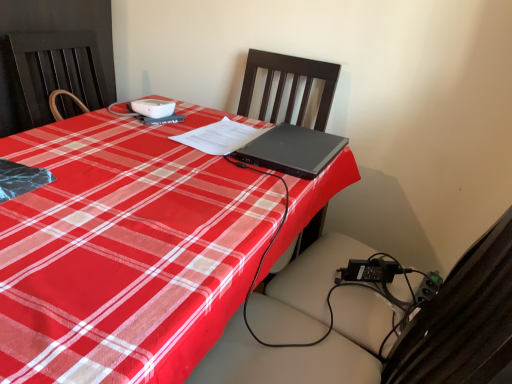
Describe the element at coordinates (292, 150) in the screenshot. I see `black matte laptop at center` at that location.

Image resolution: width=512 pixels, height=384 pixels. Identify the location of black matte laptop at center. click(292, 150).

Would you say black wood chair at center is part of black plastic swivel chair at center's contents?

No, black wood chair at center is located outside of black plastic swivel chair at center.

Is black plastic swivel chair at center in front of or behind black wood chair at center in the image?

Clearly, black plastic swivel chair at center is in front of black wood chair at center.

Which of these two, black plastic swivel chair at center or black wood chair at center, is bigger?

Bigger between the two is black plastic swivel chair at center.

From the image's perspective, is black matte laptop at center beneath black wood chair at center?

Yes, from the image's perspective, black matte laptop at center is below black wood chair at center.

Between black matte laptop at center and black wood chair at center, which one is positioned in front?

Positioned in front is black wood chair at center.

From a real-world perspective, does black matte laptop at center sit lower than black wood chair at center?

Incorrect, from a real-world perspective, black matte laptop at center is higher than black wood chair at center.

Is point (277, 107) closer or farther from the camera than point (263, 159)?

Clearly, point (277, 107) is more distant from the camera than point (263, 159).

How distant is black wood chair at center from black matte laptop at center?

A distance of 37.46 centimeters exists between black wood chair at center and black matte laptop at center.

Is black wood chair at center inside or outside of black matte laptop at center?

black wood chair at center exists outside the volume of black matte laptop at center.

Which object is positioned more to the right, black wood chair at center or black matte laptop at center?

black matte laptop at center is more to the right.

Where is `laptop that is above the black plastic swivel chair at center (from a real-world perspective)`? The width and height of the screenshot is (512, 384). laptop that is above the black plastic swivel chair at center (from a real-world perspective) is located at coordinates (292, 150).

Would you say black matte laptop at center is to the left or to the right of black plastic swivel chair at center in the picture?

black matte laptop at center is to the left of black plastic swivel chair at center.

Is black matte laptop at center placed right next to black plastic swivel chair at center?

black matte laptop at center and black plastic swivel chair at center are clearly separated.

Measure the distance from black matte laptop at center to black plastic swivel chair at center.

black matte laptop at center is 15.47 inches from black plastic swivel chair at center.

Looking at this image, from the image's perspective, would you say black plastic swivel chair at center is shown under black matte laptop at center?

Correct, black plastic swivel chair at center appears lower than black matte laptop at center in the image.

What's the angular difference between black plastic swivel chair at center and black matte laptop at center's facing directions?

black plastic swivel chair at center and black matte laptop at center are facing 86.7 degrees away from each other.

Measure the distance between black plastic swivel chair at center and black matte laptop at center.

black plastic swivel chair at center is 15.47 inches away from black matte laptop at center.

Does black plastic swivel chair at center have a lesser height compared to black matte laptop at center?

In fact, black plastic swivel chair at center may be taller than black matte laptop at center.

From the image's perspective, between black wood chair at center and black plastic swivel chair at center, who is located below?

black plastic swivel chair at center.

Is black wood chair at center looking in the opposite direction of black plastic swivel chair at center?

black wood chair at center does not have its back to black plastic swivel chair at center.

Between black wood chair at center and black plastic swivel chair at center, which one has larger width?

black plastic swivel chair at center.

Where is `swivel chair in front of the black wood chair at center`? This screenshot has width=512, height=384. swivel chair in front of the black wood chair at center is located at coordinates (392, 333).

The height and width of the screenshot is (384, 512). I want to click on laptop that appears on the right of black wood chair at center, so click(x=292, y=150).

Looking at the image, which one is located closer to black matte laptop at center, black plastic swivel chair at center or black wood chair at center?

The object closer to black matte laptop at center is black wood chair at center.

Looking at this image, based on their spatial positions, is black plastic swivel chair at center or black matte laptop at center further from black wood chair at center?

Among the two, black plastic swivel chair at center is located further to black wood chair at center.

Estimate the real-world distances between objects in this image. Which object is further from black matte laptop at center, black wood chair at center or black plastic swivel chair at center?

The object further to black matte laptop at center is black plastic swivel chair at center.

From the image, which object appears to be nearer to black plastic swivel chair at center, black wood chair at center or black matte laptop at center?

Based on the image, black matte laptop at center appears to be nearer to black plastic swivel chair at center.

Based on their spatial positions, is black matte laptop at center or black plastic swivel chair at center closer to black wood chair at center?

black matte laptop at center is closer to black wood chair at center.

From the image, which object appears to be farther from black plastic swivel chair at center, black matte laptop at center or black wood chair at center?

black wood chair at center is further to black plastic swivel chair at center.

Find the location of a particular element. The height and width of the screenshot is (384, 512). chair between black plastic swivel chair at center and black matte laptop at center along the z-axis is located at coordinates [x=291, y=87].